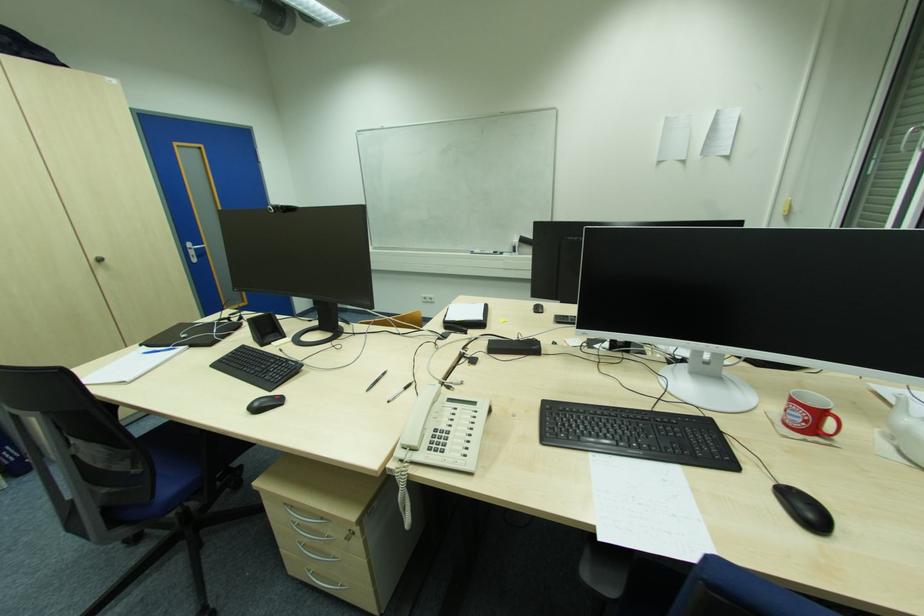
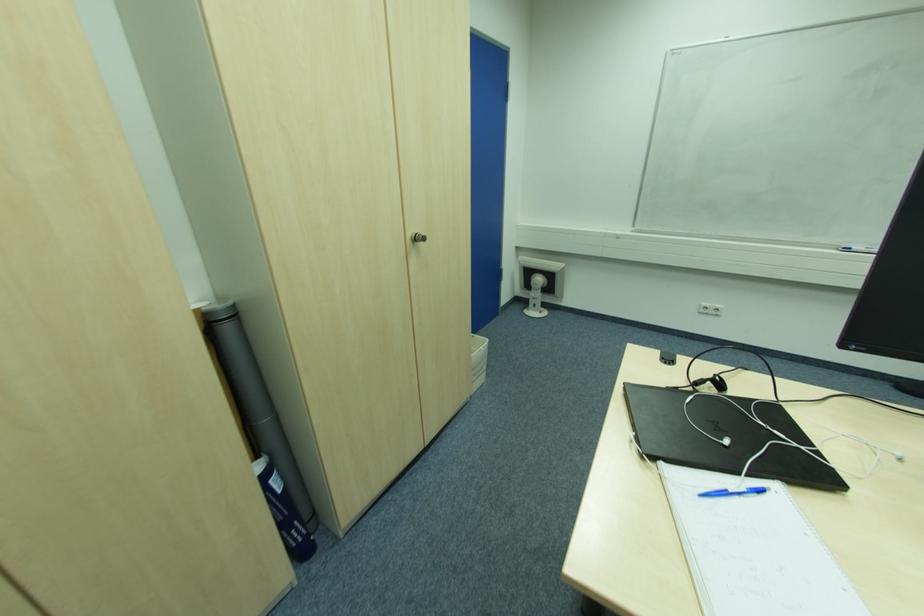
The images are taken continuously from a first-person perspective. In which direction are you moving?

The cameraman moved toward left, forward.